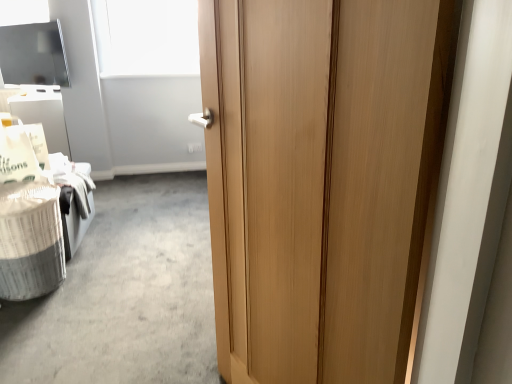
Question: From a real-world perspective, relative to wooden door at center, is white matte window screen at upper center vertically above or below?

Choices:
 (A) below
 (B) above

Answer: (B)

Question: Is white matte window screen at upper center in front of or behind wooden door at center in the image?

Choices:
 (A) behind
 (B) front

Answer: (A)

Question: Based on their relative distances, which object is nearer to the white matte window screen at upper center?

Choices:
 (A) white textured laundry basket at lower left
 (B) wooden door at center

Answer: (A)

Question: Based on their relative distances, which object is farther from the white textured laundry basket at lower left?

Choices:
 (A) wooden door at center
 (B) white matte window screen at upper center

Answer: (B)